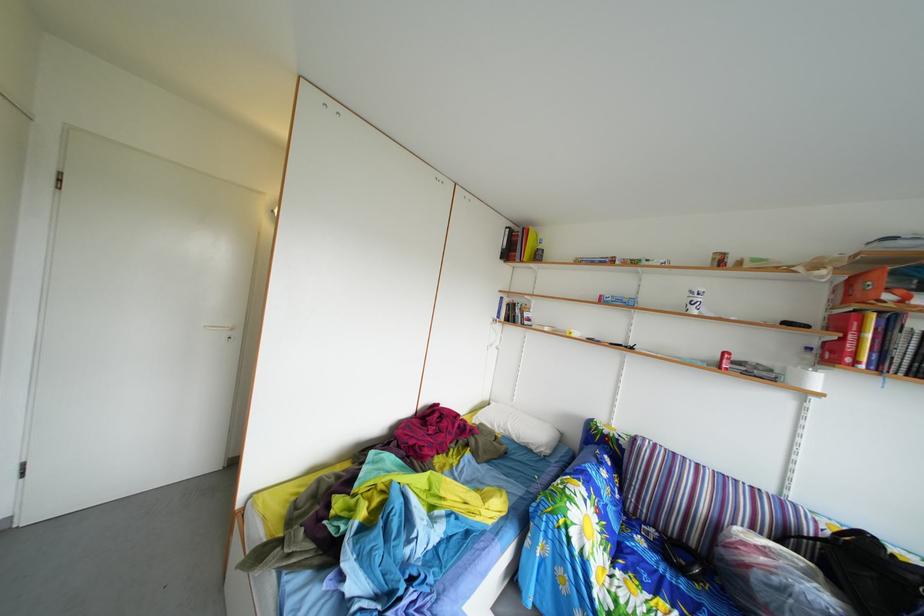
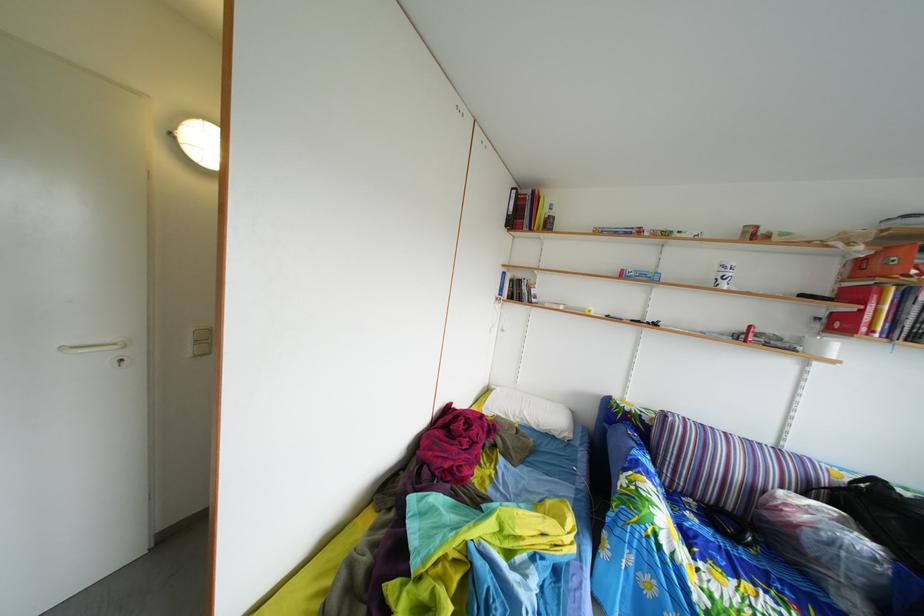
In a continuous first-person perspective shot, in which direction is the camera moving?

The movement direction of the cameraman is left, forward.